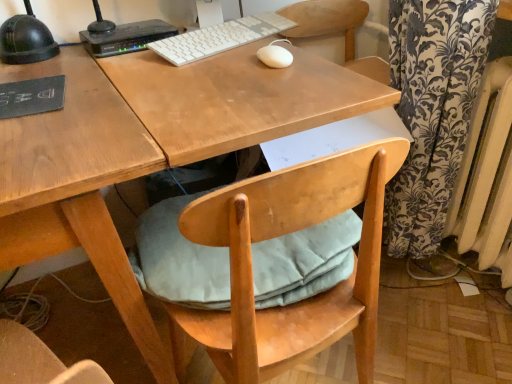
Identify the location of free point behind white matte mouse at center. This screenshot has width=512, height=384. (254, 40).